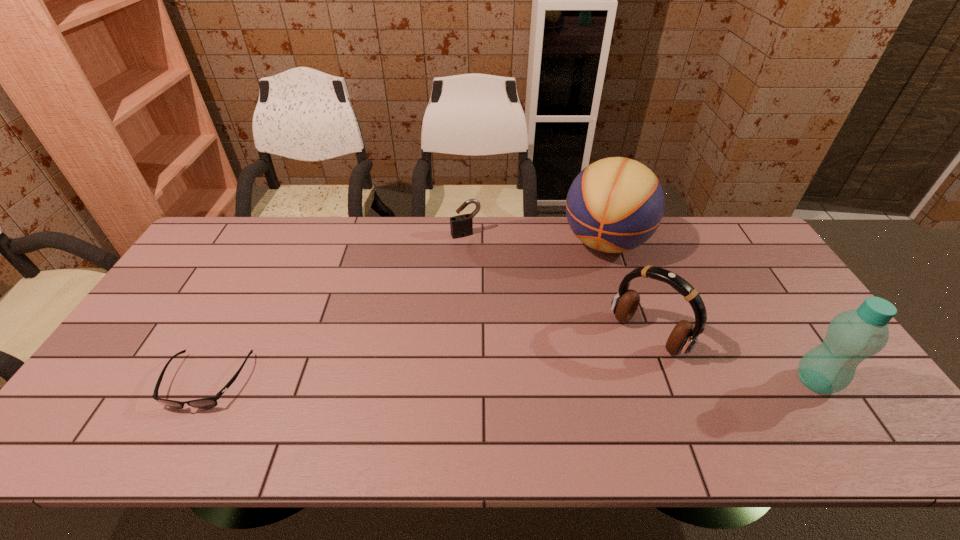
You are a GUI agent. You are given a task and a screenshot of the screen. Output one action in this format:
    pyautogui.click(x=<x>, y=<y>)
    Task: Click on the vacant space on the desktop that is between the leftmost object and the rightmost object and is positioned with the keyhole on the front of the second object from left to right
    
    Given the screenshot: What is the action you would take?
    pyautogui.click(x=544, y=381)

At what (x,y) coordinates should I click in order to perform the action: click on free space on the desktop that is between the sunglasses and the bottle and is positioned on the ear cup of the headset. Please return your answer as a coordinate pair (x, y). Looking at the image, I should click on (603, 381).

Locate an element on the screen. free space on the desktop that is between the shortest object and the bottle and is positioned on the patterned surface of the basketball is located at coordinates point(537,381).